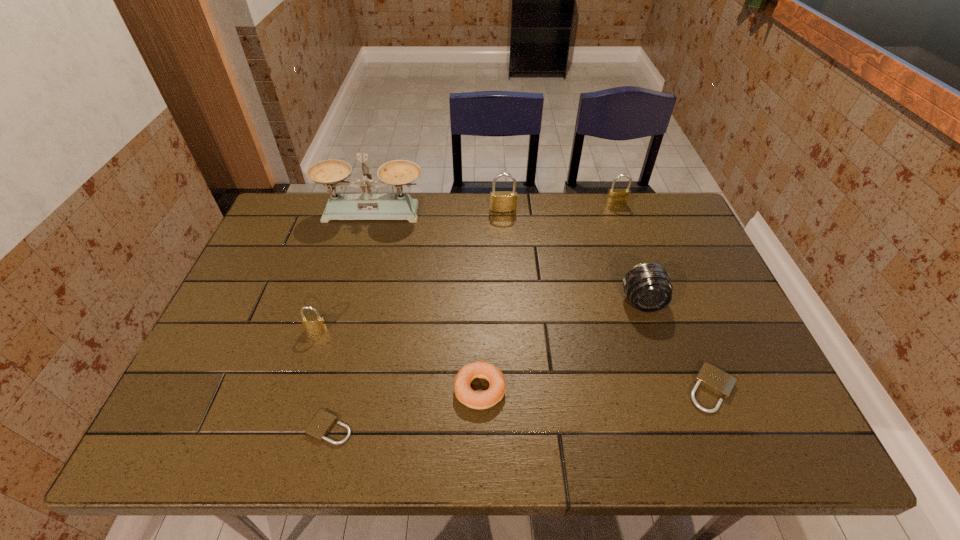
Identify the location of blank area located on the back of the second shortest object. Image resolution: width=960 pixels, height=540 pixels. (656, 252).

Image resolution: width=960 pixels, height=540 pixels. What are the coordinates of `vacant space positioned 0.080m on the back of the smaller beige padlock` in the screenshot? It's located at (342, 380).

You are a GUI agent. You are given a task and a screenshot of the screen. Output one action in this format:
    pyautogui.click(x=<x>, y=<y>)
    Task: Click on the scale that is positioned at the far edge
    
    Given the screenshot: What is the action you would take?
    pyautogui.click(x=331, y=173)

I want to click on bagel that is at the near edge, so click(465, 394).

In order to click on object positioned at the left edge in this screenshot , I will do `click(331, 173)`.

Where is `object present at the right edge`? This screenshot has height=540, width=960. object present at the right edge is located at coordinates (712, 378).

Where is `object located at the far left corner`? The width and height of the screenshot is (960, 540). object located at the far left corner is located at coordinates (331, 173).

Identify the location of object that is at the near right corner. (712, 378).

The image size is (960, 540). In the image, there is a desktop. In order to click on vacant area at the far edge in this screenshot , I will do `click(523, 215)`.

Find the location of a particular element. Image resolution: width=960 pixels, height=540 pixels. vacant region at the near edge of the desktop is located at coordinates (393, 426).